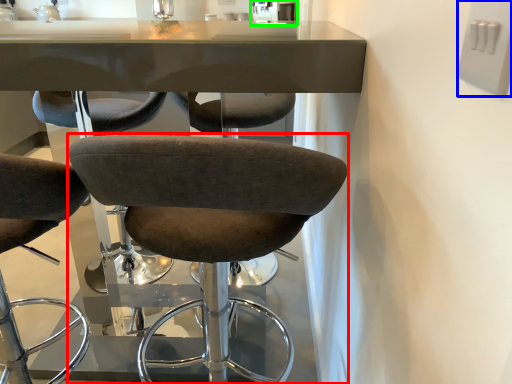
Question: Which is nearer to the chair (highlighted by a red box)? electric outlet (highlighted by a blue box) or sink (highlighted by a green box).

Choices:
 (A) electric outlet
 (B) sink

Answer: (A)